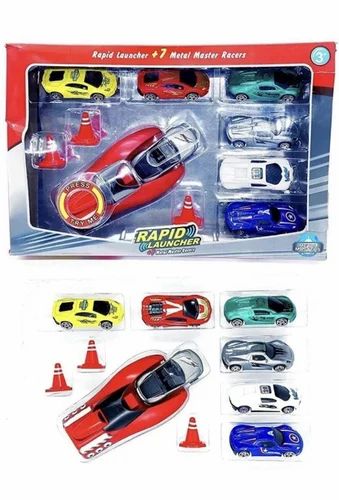
Locate an element on the screen. The image size is (339, 500). corner is located at coordinates (10, 252), (325, 256), (333, 42), (5, 41).